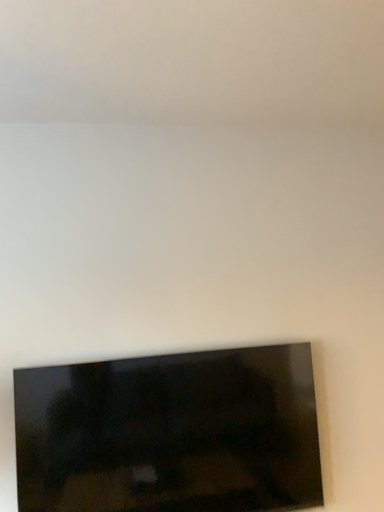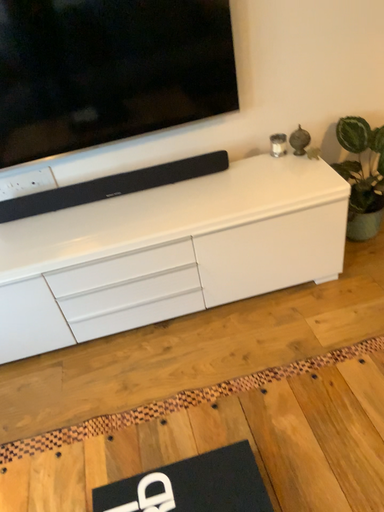
Question: Which way did the camera rotate in the video?

Choices:
 (A) rotated downward
 (B) rotated upward

Answer: (A)